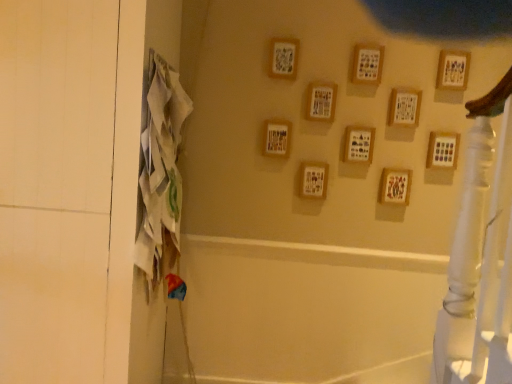
Question: Is wooden frame at center-right, the 7th picture frame from the left, inside or outside of wooden picture frame at upper center, arranged as the 3th picture frame when viewed from the right?

Choices:
 (A) inside
 (B) outside

Answer: (B)

Question: From a real-world perspective, is wooden frame at center-right, the 7th picture frame from the left, physically located above or below wooden picture frame at upper center, which is the 8th picture frame in left-to-right order?

Choices:
 (A) below
 (B) above

Answer: (A)

Question: Based on their relative distances, which object is nearer to the wooden picture frame at center, which is counted as the 4th picture frame, starting from the left?

Choices:
 (A) wooden picture frame at upper right, the first picture frame viewed from the right
 (B) wooden frame at center-right, which ranks as the 4th picture frame in right-to-left order
 (C) white fabric screen door at left
 (D) wooden frame at center, which appears as the 8th picture frame when viewed from the right
 (E) wooden picture frame at upper center, arranged as the 3th picture frame when viewed from the right

Answer: (D)

Question: Which is farther from the wooden picture frame at right, the ninth picture frame in the left-to-right sequence?

Choices:
 (A) wooden picture frame at upper center, which is the 8th picture frame in left-to-right order
 (B) wooden frame at center, acting as the first picture frame starting from the left
 (C) wooden frame at upper center, which is the second picture frame in left-to-right order
 (D) wooden picture frame at upper center, which is the 6th picture frame in left-to-right order
 (E) wooden picture frame at upper right, arranged as the 10th picture frame when viewed from the left

Answer: (C)